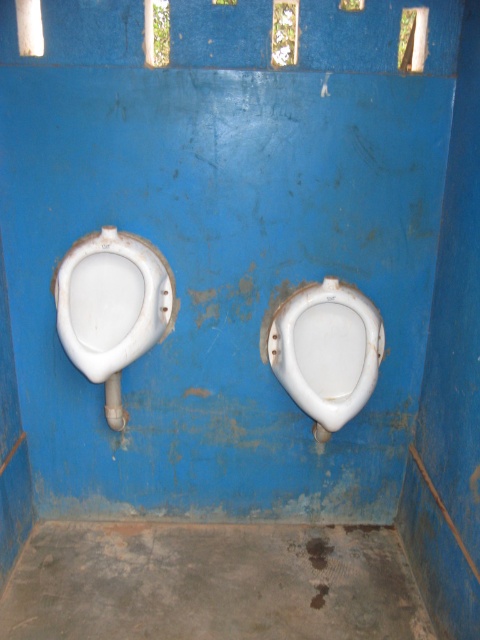
Question: Does white glossy urinal at left have a lesser width compared to white glossy toilet bowl at center?

Choices:
 (A) no
 (B) yes

Answer: (A)

Question: Is white glossy urinal at left closer to the viewer compared to white glossy toilet bowl at center?

Choices:
 (A) no
 (B) yes

Answer: (B)

Question: Which object is closer to the camera taking this photo?

Choices:
 (A) white glossy toilet bowl at center
 (B) white glossy urinal at left

Answer: (B)

Question: From the image, what is the correct spatial relationship of white glossy urinal at left in relation to white glossy toilet bowl at center?

Choices:
 (A) left
 (B) right

Answer: (A)

Question: Which of the following is the closest to the observer?

Choices:
 (A) (268, 339)
 (B) (62, 305)

Answer: (B)